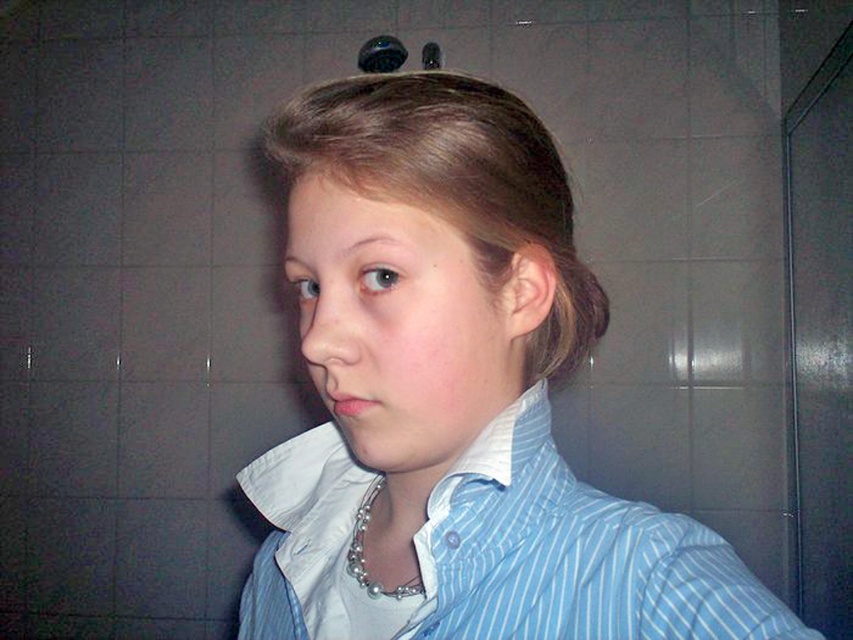
Between point (563, 220) and point (543, 355), which one is positioned in front?

Positioned in front is point (563, 220).

Does blue striped shirt at center have a smaller size compared to slightly shiny brown hair at ear?

Actually, blue striped shirt at center might be larger than slightly shiny brown hair at ear.

Between point (705, 534) and point (595, 305), which one is positioned in front?

Point (705, 534) is in front.

I want to click on blue striped shirt at center, so click(451, 397).

Who is positioned more to the left, blue striped shirt at center or blonde smooth hair at center?

blue striped shirt at center

Between blue striped shirt at center and blonde smooth hair at center, which one is positioned higher?

Positioned higher is blonde smooth hair at center.

Is point (341, 532) closer to camera compared to point (457, 74)?

No, it is behind (457, 74).

The image size is (853, 640). I want to click on blue striped shirt at center, so click(451, 397).

Between blue striped dress shirt at center and silver metallic necklace at center, which one is positioned higher?

silver metallic necklace at center is higher up.

From the picture: Is blue striped dress shirt at center above silver metallic necklace at center?

Incorrect, blue striped dress shirt at center is not positioned above silver metallic necklace at center.

Locate an element on the screen. The height and width of the screenshot is (640, 853). blue striped dress shirt at center is located at coordinates (494, 552).